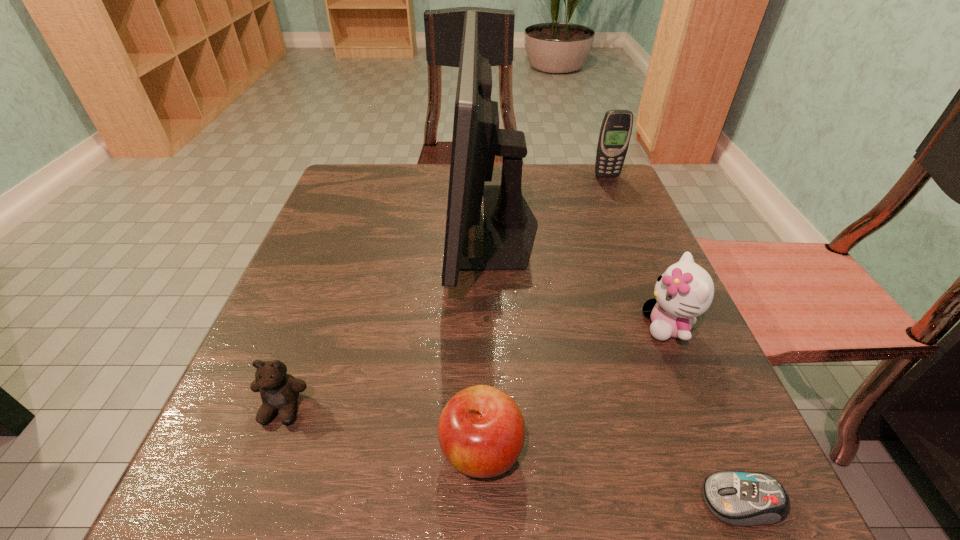
The height and width of the screenshot is (540, 960). What are the coordinates of `vacant region between the shortest object and the second tallest object` in the screenshot? It's located at (674, 339).

You are a GUI agent. You are given a task and a screenshot of the screen. Output one action in this format:
    pyautogui.click(x=<x>, y=<y>)
    Task: Click on the vacant area that lies between the leftmost object and the third tallest object
    
    Given the screenshot: What is the action you would take?
    pyautogui.click(x=475, y=367)

Find the location of a particular element. The width and height of the screenshot is (960, 540). vacant area that lies between the computer mouse and the second tallest object is located at coordinates (674, 339).

Point out which object is positioned as the fifth nearest to the computer monitor. Please provide its 2D coordinates. Your answer should be formatted as a tuple, i.e. [(x, y)], where the tuple contains the x and y coordinates of a point satisfying the conditions above.

[(741, 498)]

Point out which object is positioned as the third nearest to the third tallest object. Please provide its 2D coordinates. Your answer should be formatted as a tuple, i.e. [(x, y)], where the tuple contains the x and y coordinates of a point satisfying the conditions above.

[(481, 432)]

I want to click on free point that satisfies the following two spatial constraints: 1. on the front-facing side of the kitten; 2. on the face of the teddy bear, so click(x=703, y=408).

You are a GUI agent. You are given a task and a screenshot of the screen. Output one action in this format:
    pyautogui.click(x=<x>, y=<y>)
    Task: Click on the blank area in the image that satisfies the following two spatial constraints: 1. on the screen side of the tallest object; 2. on the face of the leftmost object
    The height and width of the screenshot is (540, 960).
    Given the screenshot: What is the action you would take?
    pyautogui.click(x=501, y=408)

Locate an element on the screen. Image resolution: width=960 pixels, height=540 pixels. vacant area that satisfies the following two spatial constraints: 1. on the face of the apple; 2. on the left side of the leftmost object is located at coordinates (267, 450).

The image size is (960, 540). I want to click on free location that satisfies the following two spatial constraints: 1. on the screen of the cellular telephone; 2. on the front-facing side of the fourth shortest object, so (x=670, y=326).

Where is `free point that satisfies the following two spatial constraints: 1. on the face of the apple; 2. on the left side of the teddy bear`? free point that satisfies the following two spatial constraints: 1. on the face of the apple; 2. on the left side of the teddy bear is located at coordinates (267, 450).